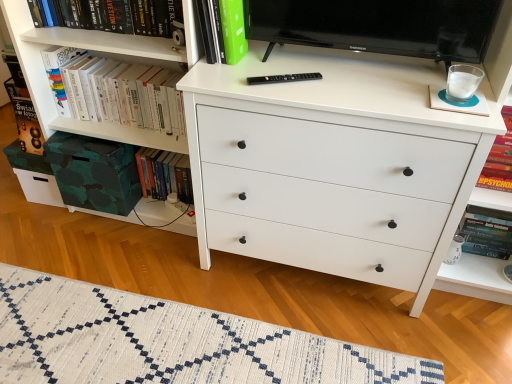
You are a GUI agent. You are given a task and a screenshot of the screen. Output one action in this format:
    pyautogui.click(x=<x>, y=<y>)
    Task: Click on the vacant space underneath black glossy television at upper center (from a real-world perspective)
    
    Given the screenshot: What is the action you would take?
    pyautogui.click(x=317, y=63)